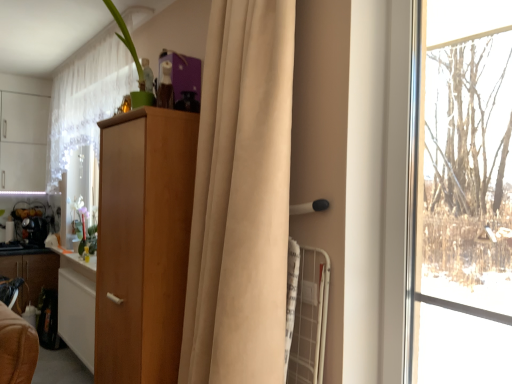
Question: From a real-world perspective, is metallic silver kettle at left, marked as the 1th appliance in a back-to-front arrangement, positioned above or below wooden cabinet at left, marked as the second cabinetry in a right-to-left arrangement?

Choices:
 (A) above
 (B) below

Answer: (A)

Question: Looking at their shapes, would you say metallic silver kettle at left, which is the 2th appliance from front to back, is wider or thinner than wooden cabinet at left, placed as the first cabinetry when sorted from left to right?

Choices:
 (A) wide
 (B) thin

Answer: (A)

Question: Which of these objects is positioned closest to the translucent glass vase at left?

Choices:
 (A) black plastic coffee maker at left, the 2th appliance viewed from the back
 (B) green matte plant at upper left
 (C) wooden cabinet at left, placed as the first cabinetry when sorted from left to right
 (D) light brown wood cabinet at center, the 2th cabinetry viewed from the back
 (E) white sheer curtain at upper left, placed as the second curtain when sorted from right to left

Answer: (C)

Question: Considering the real-world distances, which object is closest to the black plastic coffee maker at left, the 1th appliance viewed from the front?

Choices:
 (A) wooden cabinet at left, placed as the first cabinetry when sorted from left to right
 (B) white sheer curtain at upper left, positioned as the 1th curtain in back-to-front order
 (C) green matte plant at upper left
 (D) beige fabric curtain at center, positioned as the first curtain in right-to-left order
 (E) translucent glass vase at left

Answer: (E)